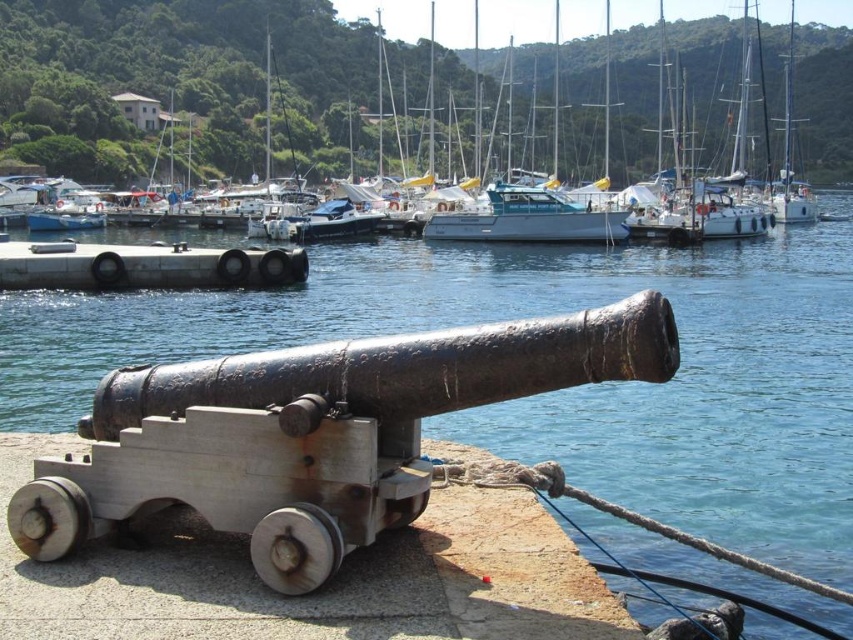
You are a visitor at the marina and want to take a photo of the white plastic boat at upper center and the rusty metal cannon at center. Which object will appear larger in the photo?

The white plastic boat at upper center is positioned over the rusty metal cannon at center, so it will appear larger in the photo.

You are a toy collector who wants to place the white plastic boat at upper center on the gray concrete dock at center. Based on the scene description, will the boat fit on the dock?

The white plastic boat at upper center is larger in width than the gray concrete dock at center, so it will not fit on the dock.

You are a photographer standing at the point labeled as point (239, 92). You want to capture a photo of the historical cannon on the stone platform by the water. Is the white plastic boat at upper center blocking your view of the cannon?

The point (239, 92) is on the white plastic boat at upper center. Since the boat is located at upper center, it might be between you and the cannon, potentially blocking the view. To determine if it blocks the view, consider the boat size and your position relative to the cannon. However, based on the given information, the white plastic boat at upper center is at upper center, so it could be obstructing the line of sight to the cannon on the stone platform by the water.